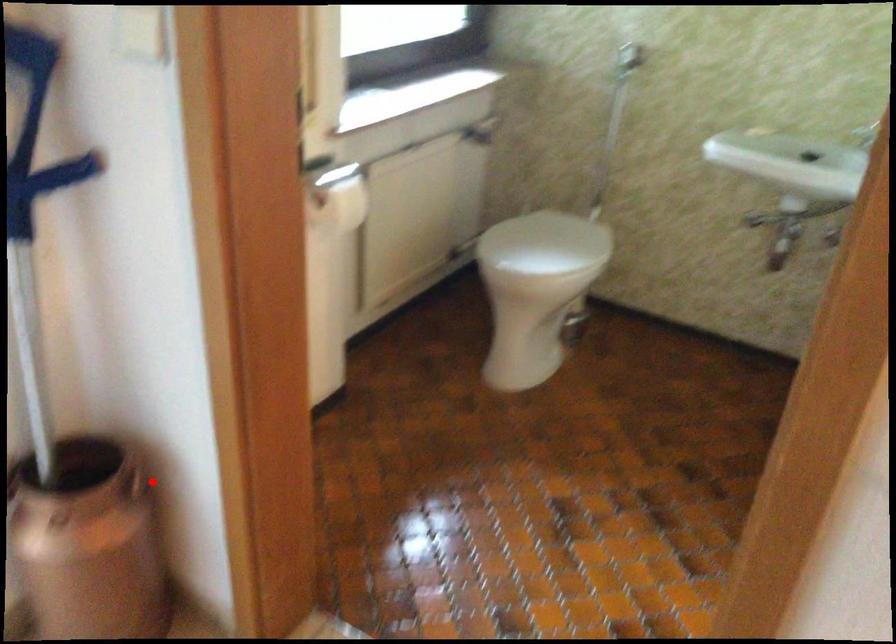
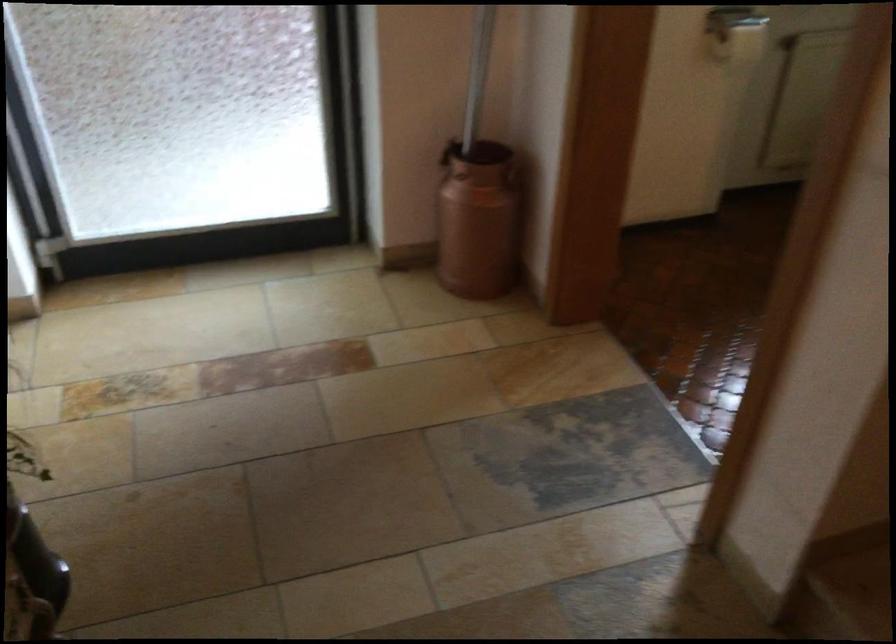
Question: I am providing you with two images of the same scene from different viewpoints. Given a red point in image1, look at the same physical point in image2. Is it:

Choices:
 (A) Closer to the viewpoint
 (B) Farther from the viewpoint

Answer: (B)